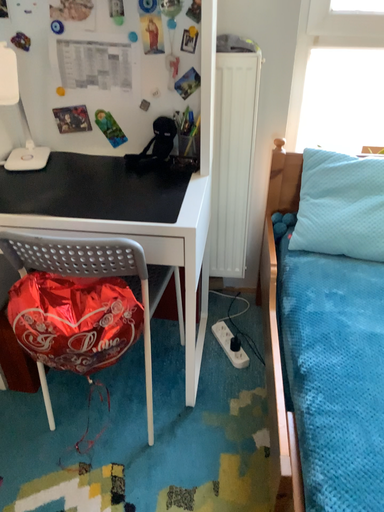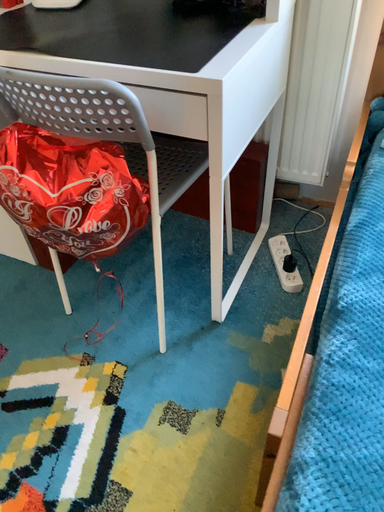
Question: How did the camera likely rotate when shooting the video?

Choices:
 (A) rotated right
 (B) rotated left

Answer: (B)